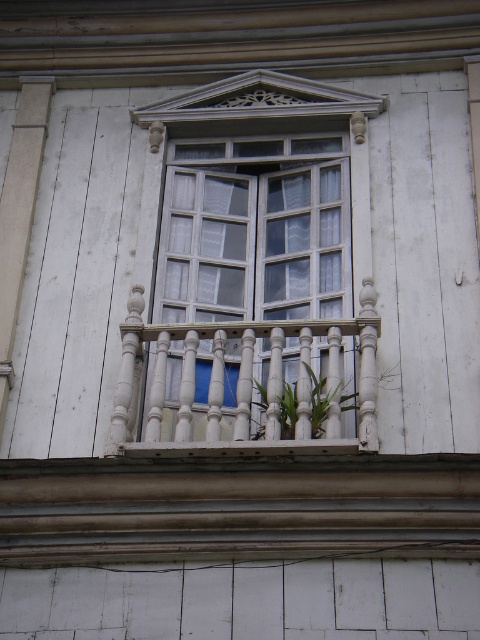
You are standing in front of the building and notice both the white wooden balcony at center and the green leafy plant at center. Which one is positioned higher up?

The white wooden balcony at center is located above the green leafy plant at center, so it is positioned higher up.

You are standing in front of the building and see the point at coordinates point (254, 230). What is the object located at that point?

The point (254, 230) is on clear glass window at center.

You are standing in front of the building and notice both the clear glass window at center and the green leafy plant at center. Which object is positioned more to the left from your perspective?

The clear glass window at center is positioned to the left of the green leafy plant at center, so it is more to the left.